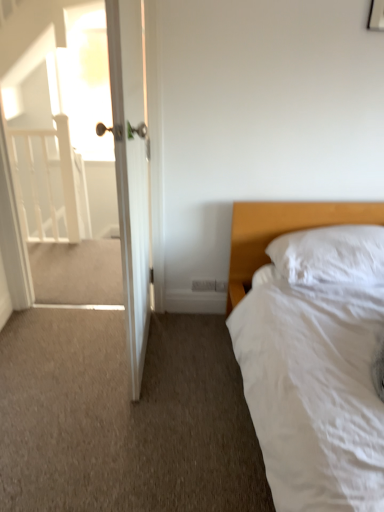
The height and width of the screenshot is (512, 384). Find the location of `vacant space positioned to the left of white wooden door at left`. vacant space positioned to the left of white wooden door at left is located at coordinates (67, 350).